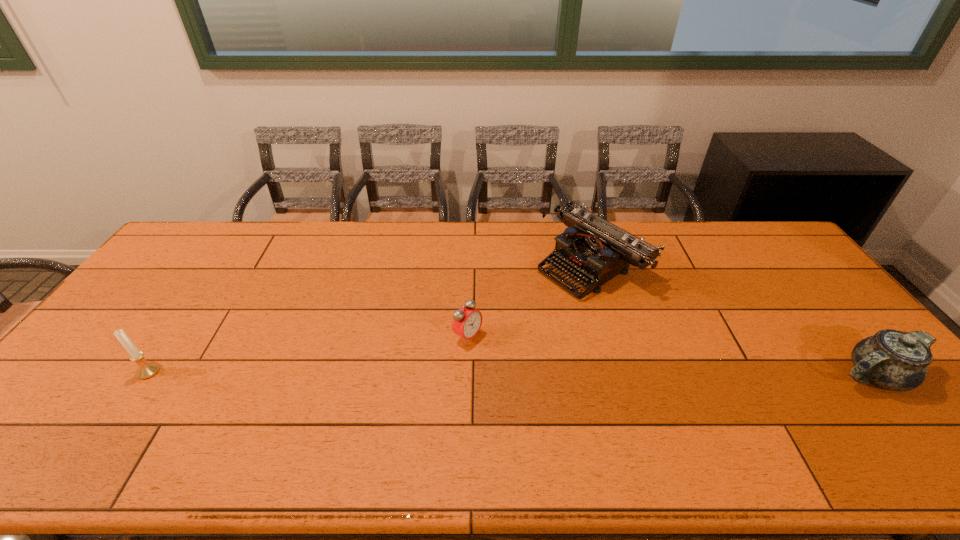
Locate an element on the screen. The width and height of the screenshot is (960, 540). vacant space located on the front-facing side of the alarm clock is located at coordinates (615, 426).

At what (x,y) coordinates should I click in order to perform the action: click on free location located 0.350m on the front-facing side of the alarm clock. Please return your answer as a coordinate pair (x, y). Image resolution: width=960 pixels, height=540 pixels. Looking at the image, I should click on (595, 414).

The width and height of the screenshot is (960, 540). In order to click on vacant point located 0.320m on the front-facing side of the alarm clock in this screenshot , I will do pos(584,407).

Where is `vacant space situated 0.370m on the keyboard of the typewriter`? vacant space situated 0.370m on the keyboard of the typewriter is located at coordinates (461, 348).

The image size is (960, 540). In order to click on free location located 0.320m on the keyboard of the typewriter in this screenshot , I will do pyautogui.click(x=475, y=339).

Where is `vacant space located on the keyboard of the typewriter`? vacant space located on the keyboard of the typewriter is located at coordinates pyautogui.click(x=540, y=296).

Image resolution: width=960 pixels, height=540 pixels. I want to click on object that is at the far edge, so click(x=594, y=249).

At what (x,y) coordinates should I click in order to perform the action: click on object at the near edge. Please return your answer as a coordinate pair (x, y). The image size is (960, 540). Looking at the image, I should click on (894, 360).

At what (x,y) coordinates should I click in order to perform the action: click on object located in the right edge section of the desktop. Please return your answer as a coordinate pair (x, y). This screenshot has width=960, height=540. Looking at the image, I should click on click(x=894, y=360).

You are a GUI agent. You are given a task and a screenshot of the screen. Output one action in this format:
    pyautogui.click(x=<x>, y=<y>)
    Task: Click on the object located in the near right corner section of the desktop
    This screenshot has width=960, height=540.
    Given the screenshot: What is the action you would take?
    pyautogui.click(x=894, y=360)